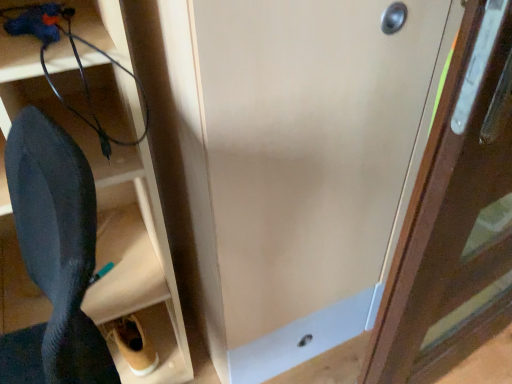
The height and width of the screenshot is (384, 512). I want to click on matte wood door at center, the second door viewed from the right, so click(x=304, y=170).

You are a GUI agent. You are given a task and a screenshot of the screen. Output one action in this format:
    pyautogui.click(x=<x>, y=<y>)
    Task: Click on the wooden door at right, which ranks as the 1th door in right-to-left order
    
    Given the screenshot: What is the action you would take?
    pyautogui.click(x=452, y=219)

Where is `black rubber wire at lower left`? Image resolution: width=512 pixels, height=384 pixels. black rubber wire at lower left is located at coordinates (88, 90).

How many degrees apart are the facing directions of black rubber wire at lower left and wooden door at right, the 2th door when ordered from left to right?

82.8 degrees separate the facing orientations of black rubber wire at lower left and wooden door at right, the 2th door when ordered from left to right.

How distant is black rubber wire at lower left from wooden door at right, the 2th door when ordered from left to right?

The distance of black rubber wire at lower left from wooden door at right, the 2th door when ordered from left to right, is 27.28 inches.

Is black rubber wire at lower left bigger than wooden door at right, the 2th door when ordered from left to right?

Actually, black rubber wire at lower left might be smaller than wooden door at right, the 2th door when ordered from left to right.

Is black rubber wire at lower left in front of wooden door at right, which ranks as the 1th door in right-to-left order?

No, it is not.

From the picture: From a real-world perspective, is wooden door at right, which ranks as the 1th door in right-to-left order, on black rubber wire at lower left?

No, from a real-world perspective, wooden door at right, which ranks as the 1th door in right-to-left order, is not on top of black rubber wire at lower left.

Is wooden door at right, the 2th door when ordered from left to right, situated inside black rubber wire at lower left or outside?

wooden door at right, the 2th door when ordered from left to right, is not enclosed by black rubber wire at lower left.

Visually, is wooden door at right, which ranks as the 1th door in right-to-left order, positioned to the left or to the right of black rubber wire at lower left?

Based on their positions, wooden door at right, which ranks as the 1th door in right-to-left order, is located to the right of black rubber wire at lower left.

Where is `wire above the wooden door at right, the 2th door when ordered from left to right (from the image's perspective)`? The height and width of the screenshot is (384, 512). wire above the wooden door at right, the 2th door when ordered from left to right (from the image's perspective) is located at coordinates (88, 90).

Is black matte shoe at lower left looking in the opposite direction of matte wood door at center, which ranks as the first door in left-to-right order?

Yes, black matte shoe at lower left's orientation is away from matte wood door at center, which ranks as the first door in left-to-right order.

From the image's perspective, between black matte shoe at lower left and matte wood door at center, the second door viewed from the right, who is located below?

From the image's view, black matte shoe at lower left is below.

From the image's perspective, which door is the 2nd one above the black matte shoe at lower left? Please provide its 2D coordinates.

[(304, 170)]

From a real-world perspective, who is located lower, black matte shoe at lower left or matte wood door at center, the second door viewed from the right?

black matte shoe at lower left, from a real-world perspective.

Relative to wooden door at right, the 2th door when ordered from left to right, is black matte shoe at lower left in front or behind?

Visually, black matte shoe at lower left is located in front of wooden door at right, the 2th door when ordered from left to right.

Can you confirm if black matte shoe at lower left is thinner than wooden door at right, which ranks as the 1th door in right-to-left order?

Yes.

Does black matte shoe at lower left have a larger size compared to wooden door at right, which ranks as the 1th door in right-to-left order?

Yes, black matte shoe at lower left is bigger than wooden door at right, which ranks as the 1th door in right-to-left order.

Choose the correct answer: Is black matte shoe at lower left inside wooden door at right, which ranks as the 1th door in right-to-left order, or outside it?

The correct answer is: outside.

Who is bigger, matte wood door at center, the second door viewed from the right, or black matte shoe at lower left?

Bigger between the two is matte wood door at center, the second door viewed from the right.

In the scene shown: Which of these two, matte wood door at center, which ranks as the first door in left-to-right order, or black matte shoe at lower left, is thinner?

With smaller width is black matte shoe at lower left.

From the image's perspective, which one is positioned lower, matte wood door at center, which ranks as the first door in left-to-right order, or black matte shoe at lower left?

black matte shoe at lower left, from the image's perspective.

Is point (334, 190) closer to camera compared to point (163, 274)?

Yes.

Is wooden door at right, which ranks as the 1th door in right-to-left order, next to matte wood door at center, which ranks as the first door in left-to-right order?

They are not placed beside each other.

Between wooden door at right, the 2th door when ordered from left to right, and matte wood door at center, the second door viewed from the right, which one has larger width?

With larger width is wooden door at right, the 2th door when ordered from left to right.

Considering the sizes of wooden door at right, which ranks as the 1th door in right-to-left order, and matte wood door at center, the second door viewed from the right, in the image, is wooden door at right, which ranks as the 1th door in right-to-left order, bigger or smaller than matte wood door at center, the second door viewed from the right,?

In the image, wooden door at right, which ranks as the 1th door in right-to-left order, appears to be smaller than matte wood door at center, the second door viewed from the right.

Is point (474, 114) closer or farther from the camera than point (372, 40)?

Point (474, 114) appears to be closer to the viewer than point (372, 40).

Which is more to the right, wooden door at right, which ranks as the 1th door in right-to-left order, or black matte shoe at lower left?

wooden door at right, which ranks as the 1th door in right-to-left order, is more to the right.

Based on their sizes in the image, would you say wooden door at right, the 2th door when ordered from left to right, is bigger or smaller than black matte shoe at lower left?

Considering their sizes, wooden door at right, the 2th door when ordered from left to right, takes up less space than black matte shoe at lower left.

Starting from the black matte shoe at lower left, which door is the 2nd one to the right? Please provide its 2D coordinates.

[(452, 219)]

From a real-world perspective, which object stands above the other?

wooden door at right, the 2th door when ordered from left to right, from a real-world perspective.

Locate an element on the screen. wire located above the wooden door at right, the 2th door when ordered from left to right (from the image's perspective) is located at coordinates (88, 90).

Find the location of a particular element. Image resolution: width=512 pixels, height=384 pixels. wire lying behind the wooden door at right, the 2th door when ordered from left to right is located at coordinates (88, 90).

Estimate the real-world distances between objects in this image. Which object is further from matte wood door at center, which ranks as the first door in left-to-right order, wooden door at right, which ranks as the 1th door in right-to-left order, or black matte shoe at lower left?

Among the two, black matte shoe at lower left is located further to matte wood door at center, which ranks as the first door in left-to-right order.

From the image, which object appears to be farther from black rubber wire at lower left, black matte shoe at lower left or wooden door at right, which ranks as the 1th door in right-to-left order?

wooden door at right, which ranks as the 1th door in right-to-left order, is positioned further to the anchor black rubber wire at lower left.

Looking at the image, which one is located closer to wooden door at right, which ranks as the 1th door in right-to-left order, black matte shoe at lower left or black rubber wire at lower left?

black matte shoe at lower left is closer to wooden door at right, which ranks as the 1th door in right-to-left order.

Based on their spatial positions, is black rubber wire at lower left or wooden door at right, the 2th door when ordered from left to right, closer to black matte shoe at lower left?

Answer: The object closer to black matte shoe at lower left is black rubber wire at lower left.

Looking at the image, which one is located further to matte wood door at center, the second door viewed from the right, black rubber wire at lower left or black matte shoe at lower left?

black rubber wire at lower left.

When comparing their distances from matte wood door at center, which ranks as the first door in left-to-right order, does wooden door at right, which ranks as the 1th door in right-to-left order, or black rubber wire at lower left seem further?

Based on the image, black rubber wire at lower left appears to be further to matte wood door at center, which ranks as the first door in left-to-right order.

Based on their spatial positions, is wooden door at right, which ranks as the 1th door in right-to-left order, or matte wood door at center, which ranks as the first door in left-to-right order, further from black matte shoe at lower left?

wooden door at right, which ranks as the 1th door in right-to-left order, is positioned further to the anchor black matte shoe at lower left.

Considering their positions, is black matte shoe at lower left positioned further to wooden door at right, which ranks as the 1th door in right-to-left order, than matte wood door at center, the second door viewed from the right?

black matte shoe at lower left lies further to wooden door at right, which ranks as the 1th door in right-to-left order, than the other object.

You are a GUI agent. You are given a task and a screenshot of the screen. Output one action in this format:
    pyautogui.click(x=<x>, y=<y>)
    Task: Click on the wire situated between black matte shoe at lower left and wooden door at right, which ranks as the 1th door in right-to-left order, from left to right
    The image size is (512, 384).
    Given the screenshot: What is the action you would take?
    pyautogui.click(x=88, y=90)

The height and width of the screenshot is (384, 512). I want to click on door between black rubber wire at lower left and wooden door at right, the 2th door when ordered from left to right, so click(304, 170).

Identify the location of door between black matte shoe at lower left and wooden door at right, which ranks as the 1th door in right-to-left order, from left to right. (304, 170).